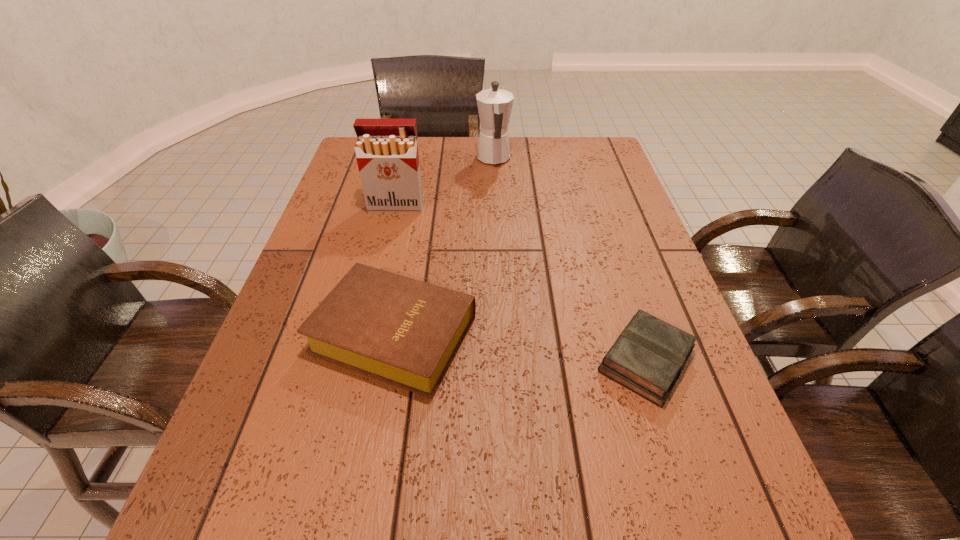
Locate an element on the screen. The image size is (960, 540). the farthest object is located at coordinates (494, 105).

Locate an element on the screen. The image size is (960, 540). the third nearest object is located at coordinates (386, 150).

This screenshot has height=540, width=960. In order to click on Bible in this screenshot , I will do `click(405, 332)`.

Locate an element on the screen. The height and width of the screenshot is (540, 960). the shortest object is located at coordinates (649, 355).

Identify the location of the rightmost object. (649, 355).

The width and height of the screenshot is (960, 540). I want to click on free spot located on the right of the coffeepot, so pos(554,159).

Locate an element on the screen. This screenshot has width=960, height=540. vacant space located with the lid open on the third nearest object is located at coordinates [374, 299].

Locate an element on the screen. The height and width of the screenshot is (540, 960). free location located on the right of the Bible is located at coordinates (600, 334).

This screenshot has height=540, width=960. In order to click on vacant space situated on the left of the shortest object in this screenshot , I will do `click(403, 360)`.

This screenshot has width=960, height=540. Identify the location of object that is at the far edge. (494, 105).